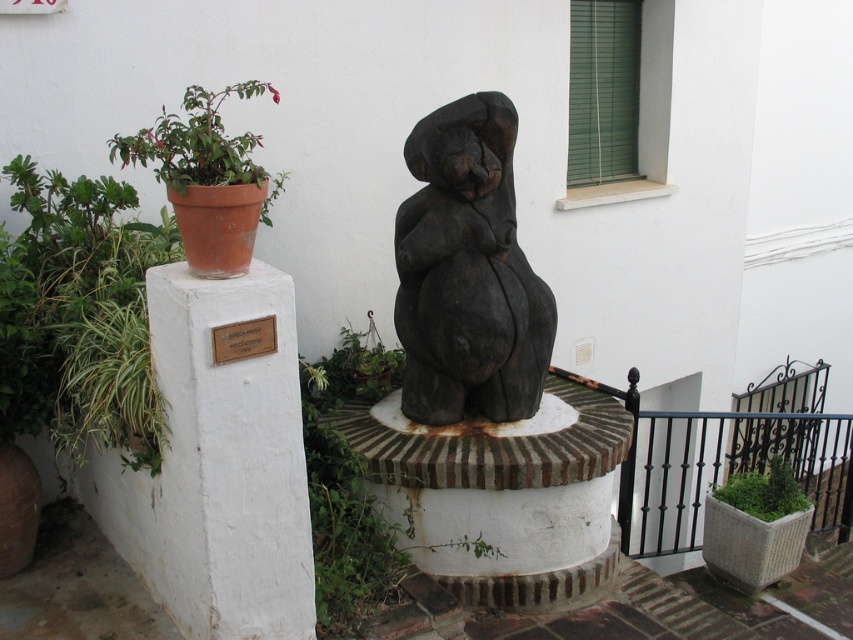
Which is more to the left, white concrete pillar at left or green mossy planter at lower right?

From the viewer's perspective, white concrete pillar at left appears more on the left side.

The width and height of the screenshot is (853, 640). What are the coordinates of `white concrete pillar at left` in the screenshot? It's located at (231, 456).

How much distance is there between matte terracotta pot at left and green mossy planter at lower right?

They are 3.12 meters apart.

Does point (277, 99) lie in front of point (723, 490)?

Yes, it is.

Which is behind, point (206, 154) or point (778, 506)?

The point (778, 506) is behind.

In order to click on matte terracotta pot at left in this screenshot , I will do `click(196, 141)`.

Is point (199, 116) positioned behind point (212, 353)?

That is True.

Identify the location of matte terracotta pot at left. (196, 141).